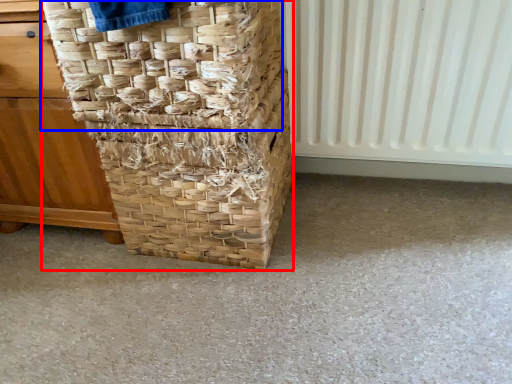
Question: Among these objects, which one is nearest to the camera, basket (highlighted by a red box) or basket (highlighted by a blue box)?

Choices:
 (A) basket
 (B) basket

Answer: (B)